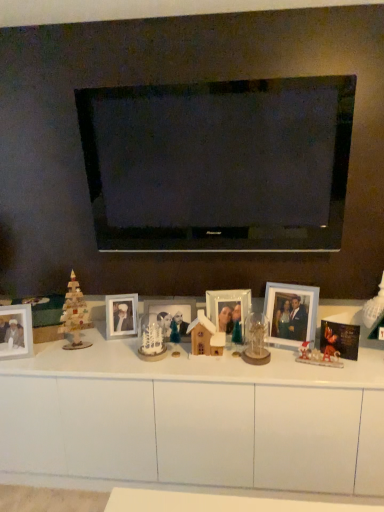
The height and width of the screenshot is (512, 384). What do you see at coordinates (16, 331) in the screenshot? I see `matte silver picture frame at left, placed as the first picture frame when sorted from left to right` at bounding box center [16, 331].

This screenshot has width=384, height=512. I want to click on white matte table at center, so pos(192,421).

Measure the distance between matte glass photo frame at center, the 3th picture frame in the left-to-right sequence, and camera.

A distance of 1.88 meters exists between matte glass photo frame at center, the 3th picture frame in the left-to-right sequence, and camera.

Where is `wooden christmas tree at left`? Image resolution: width=384 pixels, height=512 pixels. wooden christmas tree at left is located at coordinates (74, 315).

I want to click on matte silver picture frame at left, the 5th picture frame in the right-to-left sequence, so click(x=16, y=331).

Considering the sizes of objects wooden house at center, which is the second toy in right-to-left order, and white frosted glass christmas tree at center, the first toy in the left-to-right sequence, in the image provided, who is smaller, wooden house at center, which is the second toy in right-to-left order, or white frosted glass christmas tree at center, the first toy in the left-to-right sequence,?

white frosted glass christmas tree at center, the first toy in the left-to-right sequence.

Which is closer, (x=192, y=336) or (x=154, y=339)?

Clearly, point (x=192, y=336) is closer to the camera than point (x=154, y=339).

Which object is further away from the camera, wooden house at center, which is the second toy in right-to-left order, or white frosted glass christmas tree at center, the first toy in the left-to-right sequence?

white frosted glass christmas tree at center, the first toy in the left-to-right sequence.

Can you see wooden house at center, which is the second toy in right-to-left order, touching white frosted glass christmas tree at center, which ranks as the 3th toy in right-to-left order?

No, wooden house at center, which is the second toy in right-to-left order, is not beside white frosted glass christmas tree at center, which ranks as the 3th toy in right-to-left order.

Considering the sizes of objects wooden christmas tree at left and white frosted glass christmas tree at center, the first toy in the left-to-right sequence, in the image provided, who is bigger, wooden christmas tree at left or white frosted glass christmas tree at center, the first toy in the left-to-right sequence,?

wooden christmas tree at left is bigger.

From the image's perspective, is wooden christmas tree at left located above white frosted glass christmas tree at center, the first toy in the left-to-right sequence?

Yes.

Between wooden christmas tree at left and white frosted glass christmas tree at center, which ranks as the 3th toy in right-to-left order, which one appears on the right side from the viewer's perspective?

From the viewer's perspective, white frosted glass christmas tree at center, which ranks as the 3th toy in right-to-left order, appears more on the right side.

Who is taller, matte silver picture frame at left, placed as the first picture frame when sorted from left to right, or metallic silver photo frame at center, the 4th picture frame in the left-to-right sequence?

With more height is matte silver picture frame at left, placed as the first picture frame when sorted from left to right.

Based on the photo, could you tell me if matte silver picture frame at left, the 5th picture frame in the right-to-left sequence, is turned towards metallic silver photo frame at center, the 4th picture frame in the left-to-right sequence?

No, matte silver picture frame at left, the 5th picture frame in the right-to-left sequence, is not aimed at metallic silver photo frame at center, the 4th picture frame in the left-to-right sequence.

Is there a large distance between matte silver picture frame at left, placed as the first picture frame when sorted from left to right, and metallic silver photo frame at center, the 4th picture frame in the left-to-right sequence?

No, matte silver picture frame at left, placed as the first picture frame when sorted from left to right, is in close proximity to metallic silver photo frame at center, the 4th picture frame in the left-to-right sequence.

Considering the positions of points (24, 321) and (208, 317), is point (24, 321) closer to camera compared to point (208, 317)?

That is True.

Is white matte table at center not within white frosted glass christmas tree at center, the first toy in the left-to-right sequence?

Indeed, white matte table at center is completely outside white frosted glass christmas tree at center, the first toy in the left-to-right sequence.

Can you tell me how much white matte table at center and white frosted glass christmas tree at center, the first toy in the left-to-right sequence, differ in facing direction?

A: The facing directions of white matte table at center and white frosted glass christmas tree at center, the first toy in the left-to-right sequence, are 3.28 degrees apart.

Considering the relative positions of white matte table at center and white frosted glass christmas tree at center, which ranks as the 3th toy in right-to-left order, in the image provided, is white matte table at center behind white frosted glass christmas tree at center, which ranks as the 3th toy in right-to-left order,?

No.

Does white matte table at center appear on the right side of white frosted glass christmas tree at center, which ranks as the 3th toy in right-to-left order?

Yes.

Is metallic gold ornament at center-right, which is the first toy from right to left, at the back of wooden christmas tree at left?

No, wooden christmas tree at left is not facing the opposite direction of metallic gold ornament at center-right, which is the first toy from right to left.

Considering the relative positions of wooden christmas tree at left and metallic gold ornament at center-right, which is the first toy from right to left, in the image provided, is wooden christmas tree at left to the left or to the right of metallic gold ornament at center-right, which is the first toy from right to left,?

In the image, wooden christmas tree at left appears on the left side of metallic gold ornament at center-right, which is the first toy from right to left.

Based on the photo, do you think wooden christmas tree at left is within metallic gold ornament at center-right, positioned as the 3th toy in left-to-right order, or outside of it?

wooden christmas tree at left lies outside metallic gold ornament at center-right, positioned as the 3th toy in left-to-right order.

How far apart are wooden christmas tree at left and metallic gold ornament at center-right, positioned as the 3th toy in left-to-right order?

They are 38.65 inches apart.

Does matte glass photo frame at center, the 3th picture frame in the left-to-right sequence, touch white glossy picture frame at center, marked as the 4th picture frame in a right-to-left arrangement?

No, matte glass photo frame at center, the 3th picture frame in the left-to-right sequence, is not next to white glossy picture frame at center, marked as the 4th picture frame in a right-to-left arrangement.

Does point (158, 303) come farther from viewer compared to point (133, 327)?

That is True.

Considering the relative sizes of matte glass photo frame at center, positioned as the 3th picture frame in right-to-left order, and white glossy picture frame at center, placed as the second picture frame when sorted from left to right, in the image provided, is matte glass photo frame at center, positioned as the 3th picture frame in right-to-left order, taller than white glossy picture frame at center, placed as the second picture frame when sorted from left to right,?

In fact, matte glass photo frame at center, positioned as the 3th picture frame in right-to-left order, may be shorter than white glossy picture frame at center, placed as the second picture frame when sorted from left to right.

From the image's perspective, which object appears higher, matte glass photo frame at center, the 3th picture frame in the left-to-right sequence, or white glossy picture frame at center, placed as the second picture frame when sorted from left to right?

white glossy picture frame at center, placed as the second picture frame when sorted from left to right, from the image's perspective.

How different are the orientations of white glossy picture frame at center, placed as the second picture frame when sorted from left to right, and metallic gold ornament at center-right, which is the first toy from right to left, in degrees?

The angular difference between white glossy picture frame at center, placed as the second picture frame when sorted from left to right, and metallic gold ornament at center-right, which is the first toy from right to left, is 22.6 degrees.

Which of these two, white glossy picture frame at center, marked as the 4th picture frame in a right-to-left arrangement, or metallic gold ornament at center-right, positioned as the 3th toy in left-to-right order, stands shorter?

metallic gold ornament at center-right, positioned as the 3th toy in left-to-right order.

Is white glossy picture frame at center, placed as the second picture frame when sorted from left to right, not near metallic gold ornament at center-right, which is the first toy from right to left?

No, white glossy picture frame at center, placed as the second picture frame when sorted from left to right, is in close proximity to metallic gold ornament at center-right, which is the first toy from right to left.

From a real-world perspective, does white glossy picture frame at center, placed as the second picture frame when sorted from left to right, stand above metallic gold ornament at center-right, which is the first toy from right to left?

Correct, in the physical world, white glossy picture frame at center, placed as the second picture frame when sorted from left to right, is higher than metallic gold ornament at center-right, which is the first toy from right to left.

You are a GUI agent. You are given a task and a screenshot of the screen. Output one action in this format:
    pyautogui.click(x=<x>, y=<y>)
    Task: Click on the toy above the white frosted glass christmas tree at center, which ranks as the 3th toy in right-to-left order (from the image's perspective)
    This screenshot has width=384, height=512.
    Given the screenshot: What is the action you would take?
    pyautogui.click(x=205, y=336)

Identify the location of the 2nd toy below the wooden christmas tree at left (from the image's perspective). This screenshot has width=384, height=512. (152, 342).

Estimate the real-world distances between objects in this image. Which object is further from wooden christmas tree at left, wooden house at center, the second toy in the left-to-right sequence, or wooden photo frame at center, the first picture frame positioned from the right?

wooden photo frame at center, the first picture frame positioned from the right.

From the image, which object appears to be farther from white glossy picture frame at center, marked as the 4th picture frame in a right-to-left arrangement, matte silver picture frame at left, placed as the first picture frame when sorted from left to right, or wooden photo frame at center, the first picture frame positioned from the right?

Based on the image, wooden photo frame at center, the first picture frame positioned from the right, appears to be further to white glossy picture frame at center, marked as the 4th picture frame in a right-to-left arrangement.

Looking at the image, which one is located further to metallic gold ornament at center-right, which is the first toy from right to left, matte silver picture frame at left, placed as the first picture frame when sorted from left to right, or white matte table at center?

Based on the image, matte silver picture frame at left, placed as the first picture frame when sorted from left to right, appears to be further to metallic gold ornament at center-right, which is the first toy from right to left.

Estimate the real-world distances between objects in this image. Which object is closer to white glossy picture frame at center, placed as the second picture frame when sorted from left to right, matte glass photo frame at center, the 3th picture frame in the left-to-right sequence, or matte silver picture frame at left, placed as the first picture frame when sorted from left to right?

matte glass photo frame at center, the 3th picture frame in the left-to-right sequence, lies closer to white glossy picture frame at center, placed as the second picture frame when sorted from left to right, than the other object.

Estimate the real-world distances between objects in this image. Which object is further from matte silver picture frame at left, placed as the first picture frame when sorted from left to right, white matte table at center or metallic gold ornament at center-right, which is the first toy from right to left?

metallic gold ornament at center-right, which is the first toy from right to left, lies further to matte silver picture frame at left, placed as the first picture frame when sorted from left to right, than the other object.

When comparing their distances from matte glass photo frame at center, the 3th picture frame in the left-to-right sequence, does wooden house at center, the second toy in the left-to-right sequence, or white matte table at center seem further?

Among the two, white matte table at center is located further to matte glass photo frame at center, the 3th picture frame in the left-to-right sequence.

Looking at the image, which one is located closer to wooden christmas tree at left, wooden photo frame at center, which is the 5th picture frame from left to right, or white frosted glass christmas tree at center, the first toy in the left-to-right sequence?

white frosted glass christmas tree at center, the first toy in the left-to-right sequence, is closer to wooden christmas tree at left.

Which object lies further to the anchor point wooden photo frame at center, which is the 5th picture frame from left to right, matte silver picture frame at left, placed as the first picture frame when sorted from left to right, or matte glass photo frame at center, positioned as the 3th picture frame in right-to-left order?

Based on the image, matte silver picture frame at left, placed as the first picture frame when sorted from left to right, appears to be further to wooden photo frame at center, which is the 5th picture frame from left to right.

The height and width of the screenshot is (512, 384). Find the location of `christmas decoration situated between matte silver picture frame at left, placed as the first picture frame when sorted from left to right, and matte glass photo frame at center, the 3th picture frame in the left-to-right sequence, from left to right`. christmas decoration situated between matte silver picture frame at left, placed as the first picture frame when sorted from left to right, and matte glass photo frame at center, the 3th picture frame in the left-to-right sequence, from left to right is located at coordinates (74, 315).

Identify the location of toy between matte silver picture frame at left, the 5th picture frame in the right-to-left sequence, and matte glass photo frame at center, the 3th picture frame in the left-to-right sequence, from left to right. The image size is (384, 512). (152, 342).

Where is `table situated between matte silver picture frame at left, placed as the first picture frame when sorted from left to right, and wooden house at center, which is the second toy in right-to-left order, from left to right`? The height and width of the screenshot is (512, 384). table situated between matte silver picture frame at left, placed as the first picture frame when sorted from left to right, and wooden house at center, which is the second toy in right-to-left order, from left to right is located at coordinates (192, 421).

I want to click on picture frame situated between matte silver picture frame at left, the 5th picture frame in the right-to-left sequence, and matte glass photo frame at center, positioned as the 3th picture frame in right-to-left order, from left to right, so click(x=121, y=316).